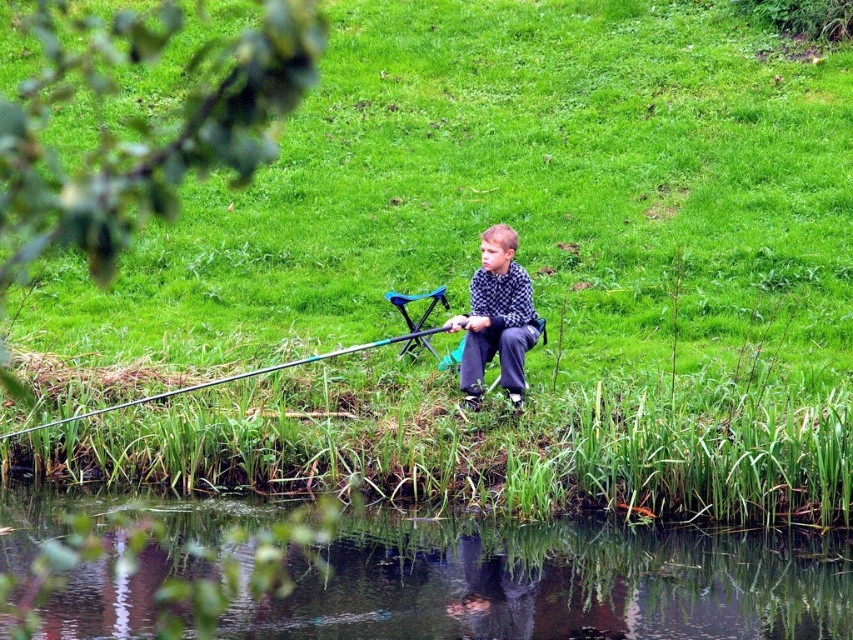
Measure the distance from checkered fabric shirt at center to teal glossy fishing pole at lower center.

checkered fabric shirt at center is 36.10 inches away from teal glossy fishing pole at lower center.

Looking at this image, which is above, checkered fabric shirt at center or teal glossy fishing pole at lower center?

checkered fabric shirt at center is above.

Who is more forward, (534, 340) or (115, 406)?

Point (115, 406) is in front.

The height and width of the screenshot is (640, 853). Find the location of `checkered fabric shirt at center`. checkered fabric shirt at center is located at coordinates (496, 320).

Is point (584, 534) closer to viewer compared to point (322, 355)?

Yes, it is.

Describe the element at coordinates (558, 584) in the screenshot. The image size is (853, 640). I see `transparent water at lower center` at that location.

Describe the element at coordinates (558, 584) in the screenshot. I see `transparent water at lower center` at that location.

Identify the location of transparent water at lower center. The height and width of the screenshot is (640, 853). (558, 584).

Who is positioned more to the left, transparent water at lower center or checkered fabric shirt at center?

checkered fabric shirt at center is more to the left.

Does transparent water at lower center appear under checkered fabric shirt at center?

Yes.

Does point (782, 609) come in front of point (496, 260)?

Yes, point (782, 609) is closer to viewer.

You are a GUI agent. You are given a task and a screenshot of the screen. Output one action in this format:
    pyautogui.click(x=<x>, y=<y>)
    Task: Click on the transparent water at lower center
    
    Given the screenshot: What is the action you would take?
    pyautogui.click(x=558, y=584)